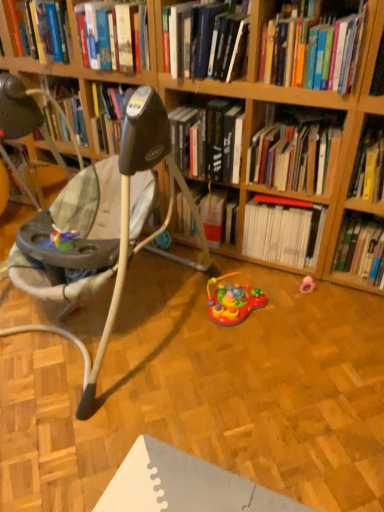
Question: Is point (183, 75) closer or farther from the camera than point (117, 44)?

Choices:
 (A) closer
 (B) farther

Answer: (A)

Question: Choose the correct answer: Is hardcover book at upper center, the 7th book positioned from the right, inside hardcover book at upper center, the 8th book positioned from the right, or outside it?

Choices:
 (A) outside
 (B) inside

Answer: (A)

Question: Estimate the real-world distances between objects in this image. Which object is closer to the white matte bookshelf at center, the third book in the right-to-left sequence?

Choices:
 (A) hardcover book at right, acting as the 1th book starting from the right
 (B) beige fabric baby swing at left
 (C) hardcover book at center, the fourth book viewed from the right
 (D) multicolored plastic toy at center, the 1th toy viewed from the left
 (E) yellow paper at upper right, which is the 7th book from left to right

Answer: (A)

Question: Estimate the real-world distances between objects in this image. Which object is farther from the wooden bookshelf at upper center?

Choices:
 (A) hardcover book at upper center, acting as the 6th book starting from the right
 (B) pink rubber pacifier at lower right, the second toy from the left
 (C) hardcover book at upper center, marked as the first book in a left-to-right arrangement
 (D) hardcover book at center, which is counted as the fifth book, starting from the left
 (E) hardcover book at upper center, the 7th book positioned from the right

Answer: (B)